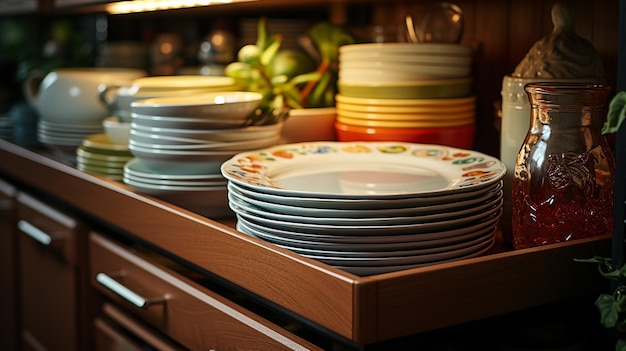
This screenshot has height=351, width=626. I want to click on yellow bowls, so click(428, 124), click(418, 118), click(402, 109), click(422, 102).